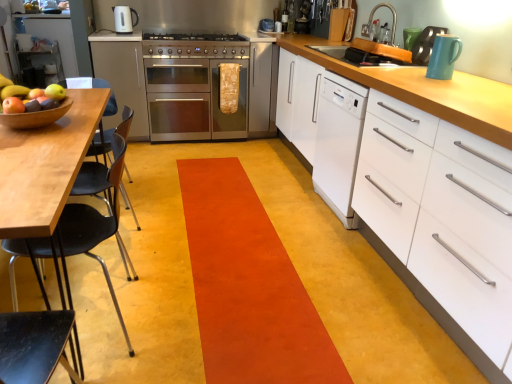
Where is `free region under matte black kettle at upper center, positioned as the second kitchen appliance in bottom-to-top order (from a real-world perspective)`? free region under matte black kettle at upper center, positioned as the second kitchen appliance in bottom-to-top order (from a real-world perspective) is located at coordinates (125, 28).